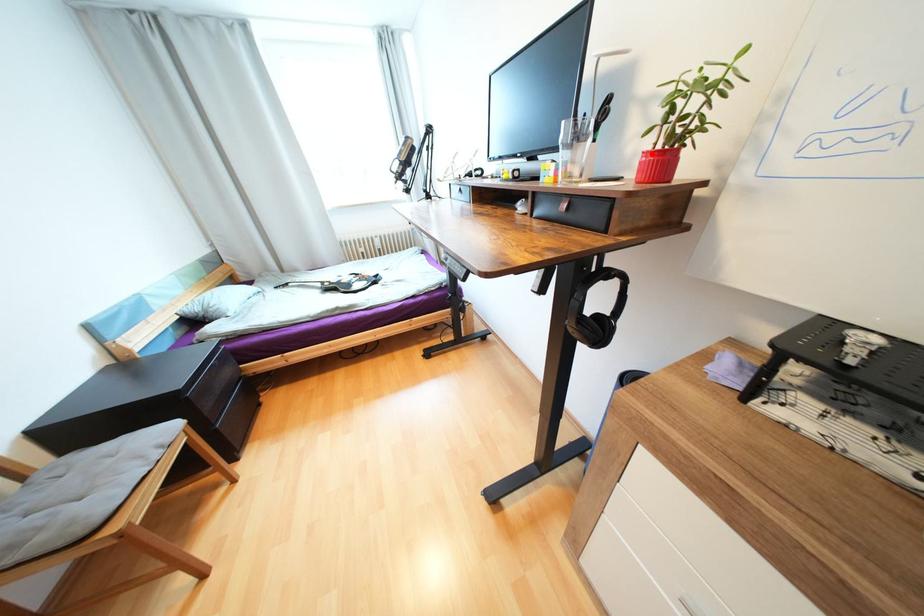
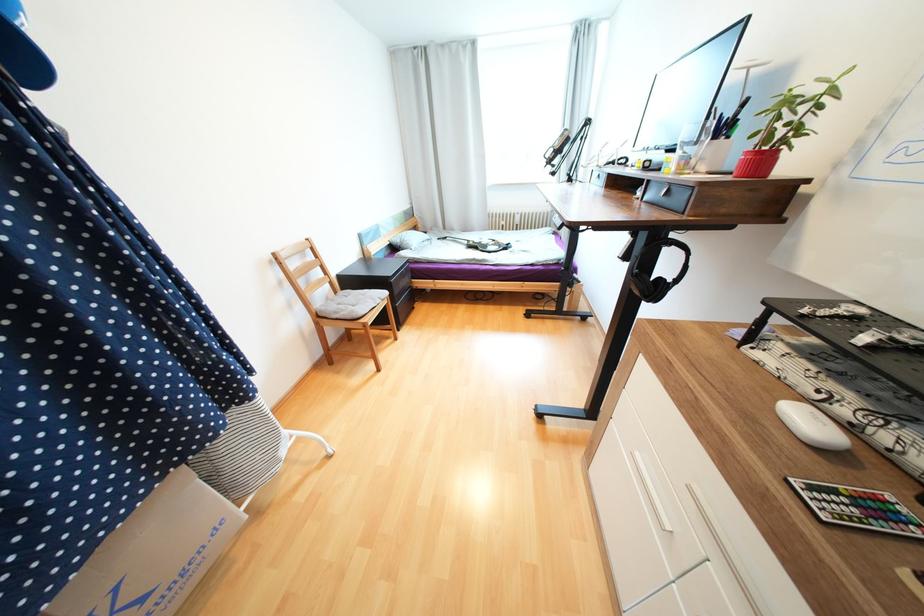
Where in the second image is the point corresponding to the highlighted location from the first image?

(752, 153)